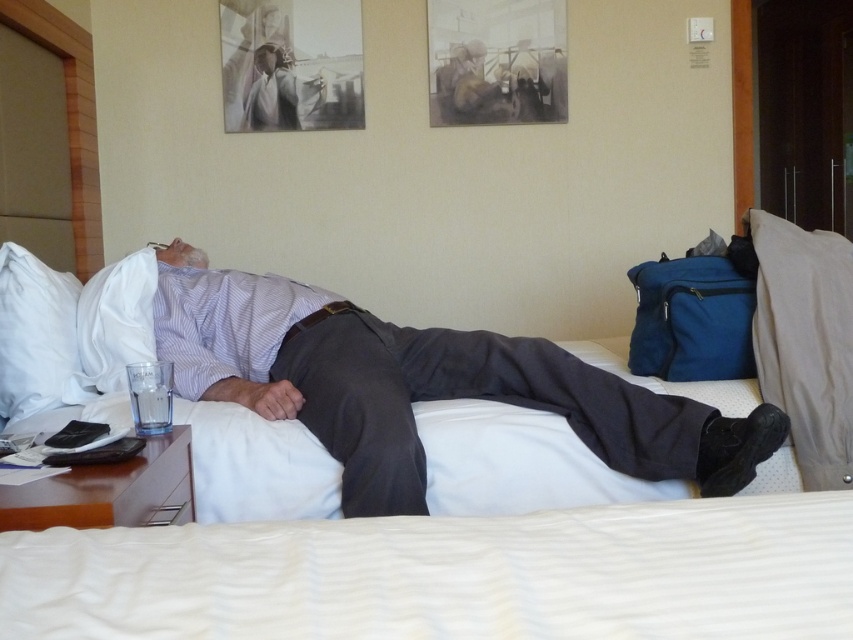
Between white fabric bed at center and white soft pillow at upper left, which one is positioned higher?

white soft pillow at upper left is above.

What do you see at coordinates (450, 573) in the screenshot?
I see `white fabric bed at center` at bounding box center [450, 573].

Image resolution: width=853 pixels, height=640 pixels. Identify the location of white fabric bed at center. (450, 573).

Is point (347, 348) positioned before point (38, 349)?

No, (347, 348) is behind (38, 349).

Locate an element on the screen. matte purple shirt at center is located at coordinates (421, 385).

Based on the photo, can you confirm if white fabric bed at center is wider than white soft pillow at left?

Yes, white fabric bed at center is wider than white soft pillow at left.

You are a GUI agent. You are given a task and a screenshot of the screen. Output one action in this format:
    pyautogui.click(x=<x>, y=<y>)
    Task: Click on the white fabric bed at center
    
    Given the screenshot: What is the action you would take?
    pyautogui.click(x=450, y=573)